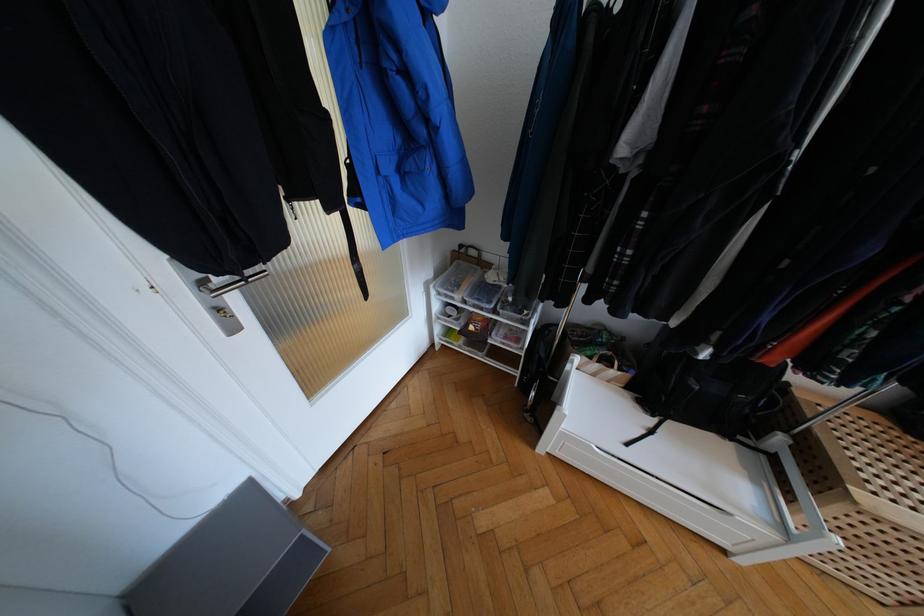
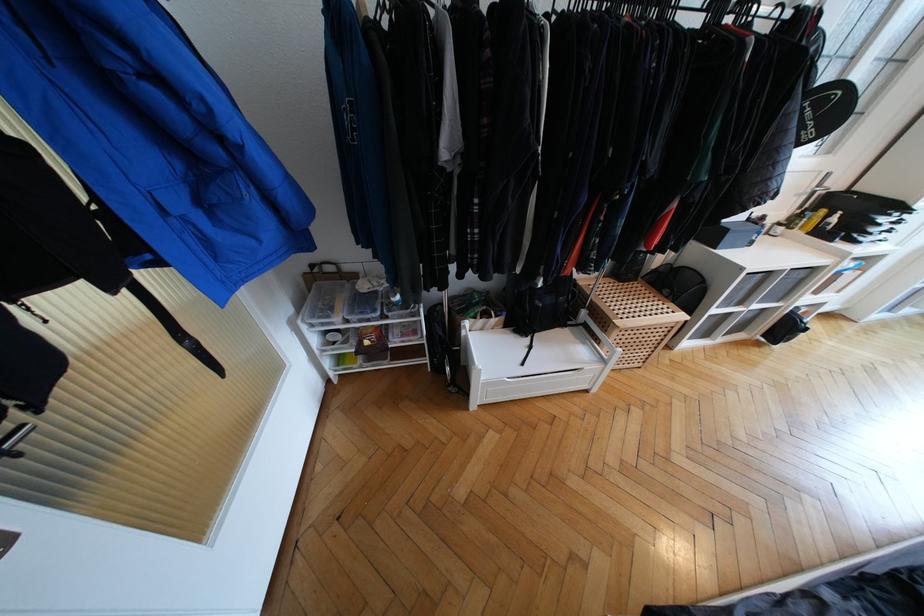
Locate, in the second image, the point that corresponds to point (505, 310) in the first image.

(393, 312)